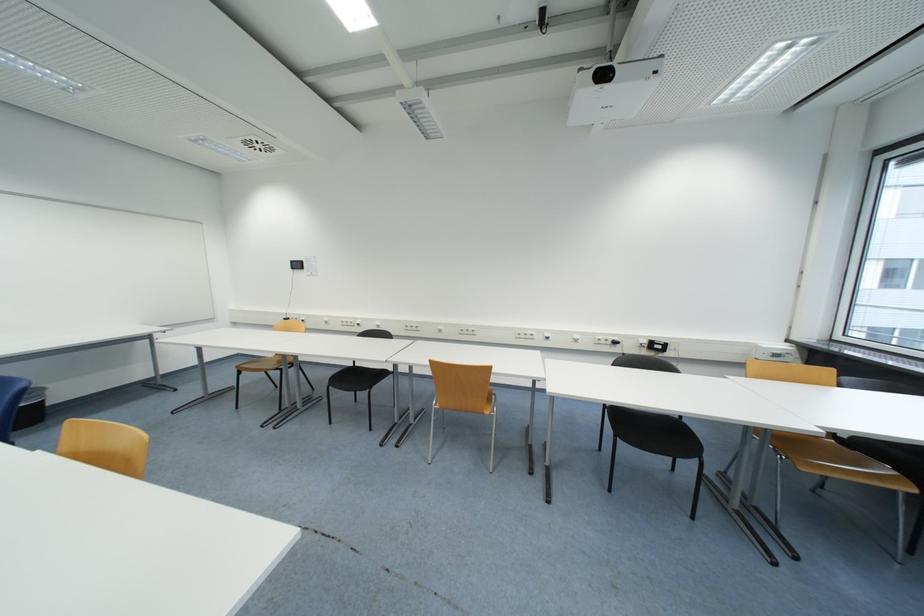
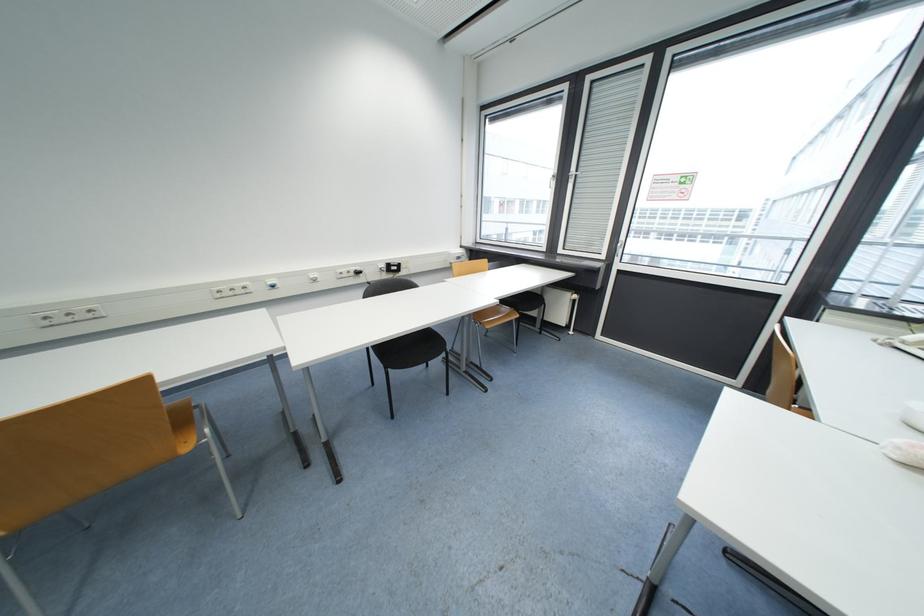
Looking at this image, first-person continuous shooting, in which direction is the camera rotating?

The camera rotated toward right-down.